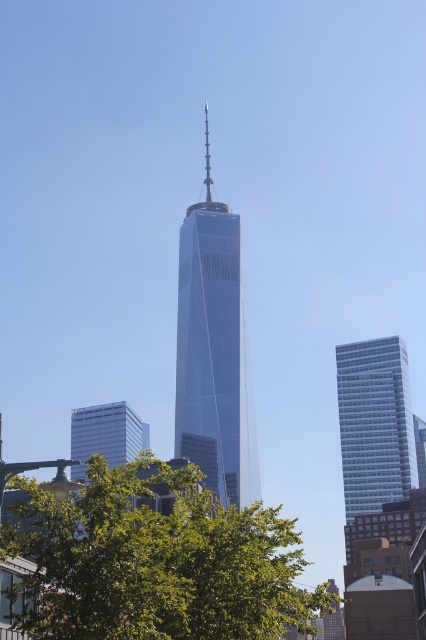
You are standing at the base of the skyscraper and want to take a photo of the two points mentioned. Which point, point (92, 465) or point (354, 442), is closer to you?

Point (92, 465) is closer to you because it is in front of point (354, 442).

You are a city planner analyzing the skyline. Given the glassy steel skyscraper at center and the white glass building at right, which one has a greater width?

The glassy steel skyscraper at center has a greater width than the white glass building at right.

You are standing on the observation deck of the glassy steel skyscraper at center. You look down and see the tree and streetlamp in the foreground. If you were to drop a penny straight down, where would it land first? The penny will hit the tree or the streetlamp first?

The penny will hit the tree first because the tree is closer to the viewer than the streetlamp.